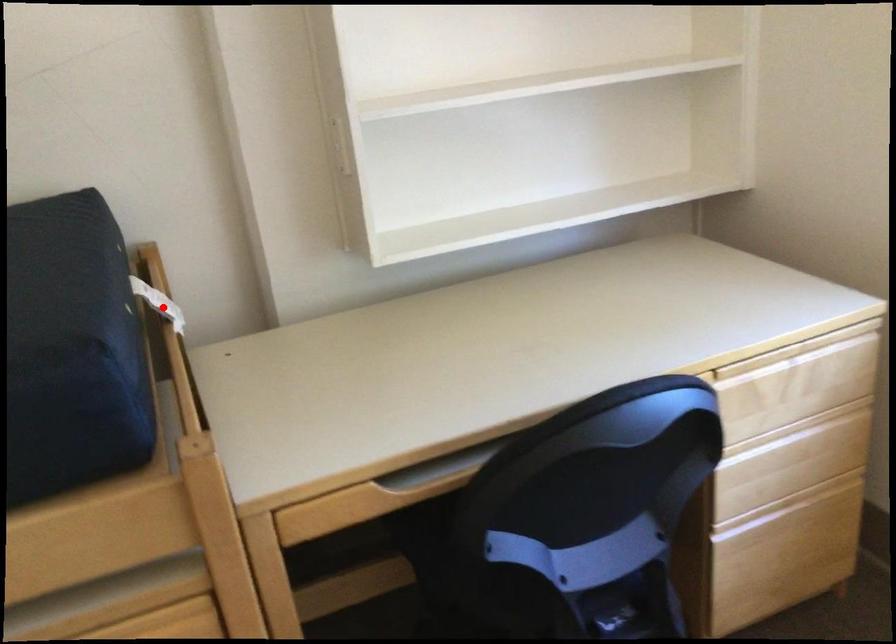
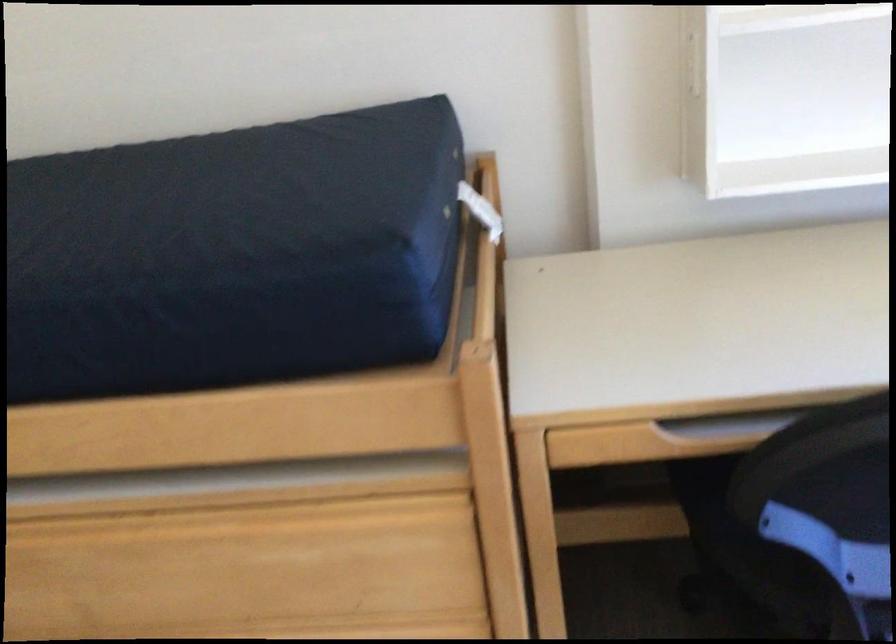
Find the pixel in the second image that matches the highlighted location in the first image.

(480, 211)